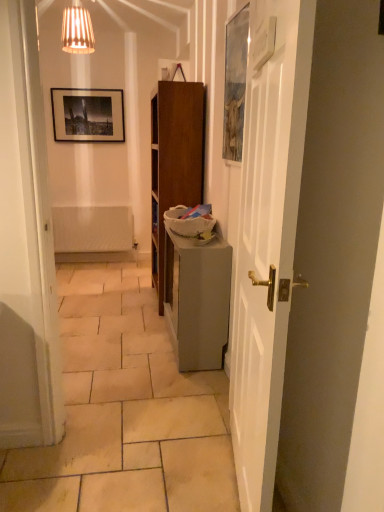
Question: Is matte gray table at center spatially inside white wooden door at right, or outside of it?

Choices:
 (A) inside
 (B) outside

Answer: (B)

Question: From a real-world perspective, relative to white wooden door at right, is matte gray table at center vertically above or below?

Choices:
 (A) above
 (B) below

Answer: (B)

Question: From the image's perspective, is matte gray table at center above or below white wooden door at right?

Choices:
 (A) above
 (B) below

Answer: (B)

Question: Based on their sizes in the image, would you say white wooden door at right is bigger or smaller than matte gray table at center?

Choices:
 (A) small
 (B) big

Answer: (A)

Question: Is point (256, 103) closer or farther from the camera than point (210, 296)?

Choices:
 (A) farther
 (B) closer

Answer: (B)

Question: Is white wooden door at right wider or thinner than matte gray table at center?

Choices:
 (A) thin
 (B) wide

Answer: (A)

Question: In the image, is white wooden door at right positioned in front of or behind matte gray table at center?

Choices:
 (A) behind
 (B) front

Answer: (B)